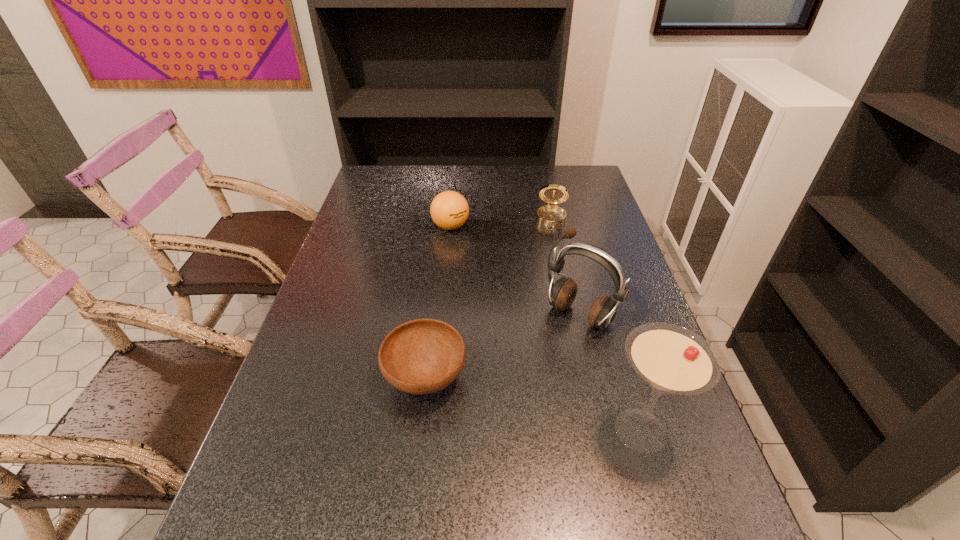
Image resolution: width=960 pixels, height=540 pixels. I want to click on vacant space on the desktop that is between the bowl and the martini and is positioned on the side with brand of the ping-pong ball, so click(517, 401).

You are a GUI agent. You are given a task and a screenshot of the screen. Output one action in this format:
    pyautogui.click(x=<x>, y=<y>)
    Task: Click on the free space on the desktop that is between the shortest object and the martini and is positioned on the ear pads of the earphone
    
    Given the screenshot: What is the action you would take?
    pyautogui.click(x=511, y=399)

What are the coordinates of `vacant space on the desktop that is between the bowl and the martini and is positioned with the dial facing the compass` in the screenshot? It's located at (531, 404).